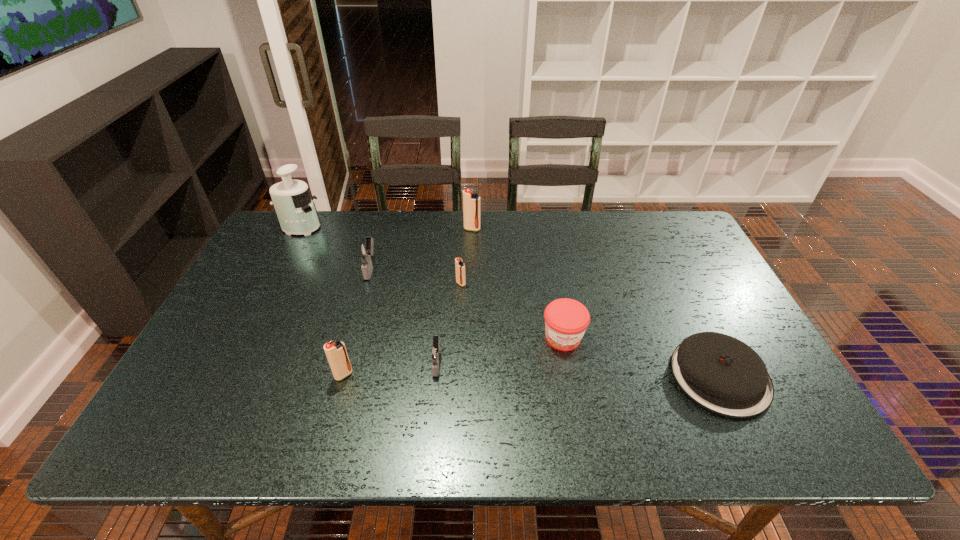
Identify the location of free space between the shortest object and the juicer. (510, 302).

Locate an element on the screen. Image resolution: width=960 pixels, height=540 pixels. free space between the leftmost red igniter and the pancake is located at coordinates (532, 376).

In order to click on vacant area that lies between the second smallest red igniter and the right gray igniter in this screenshot , I will do `click(390, 369)`.

Locate an element on the screen. vacant point located between the seventh shortest object and the second nearest red igniter is located at coordinates (467, 256).

The image size is (960, 540). I want to click on free spot between the nearest red igniter and the smallest red igniter, so click(x=402, y=329).

You are a GUI agent. You are given a task and a screenshot of the screen. Output one action in this format:
    pyautogui.click(x=<x>, y=<y>)
    Task: Click on the object identified as the closest to the tallest object
    This screenshot has width=960, height=540.
    Given the screenshot: What is the action you would take?
    pyautogui.click(x=364, y=250)

Select which object is the sixth closest to the juicer. Please provide its 2D coordinates. Your answer should be formatted as a tuple, i.e. [(x, y)], where the tuple contains the x and y coordinates of a point satisfying the conditions above.

[(566, 320)]

Locate which igniter is the closest to the red jam. Please provide its 2D coordinates. Your answer should be formatted as a tuple, i.e. [(x, y)], where the tuple contains the x and y coordinates of a point satisfying the conditions above.

[(435, 352)]

Image resolution: width=960 pixels, height=540 pixels. Find the location of `igniter that is the fourth closest to the farthest igniter`. igniter that is the fourth closest to the farthest igniter is located at coordinates (336, 353).

Identify which red igniter is the nearest to the smallest red igniter. Please provide its 2D coordinates. Your answer should be formatted as a tuple, i.e. [(x, y)], where the tuple contains the x and y coordinates of a point satisfying the conditions above.

[(471, 202)]